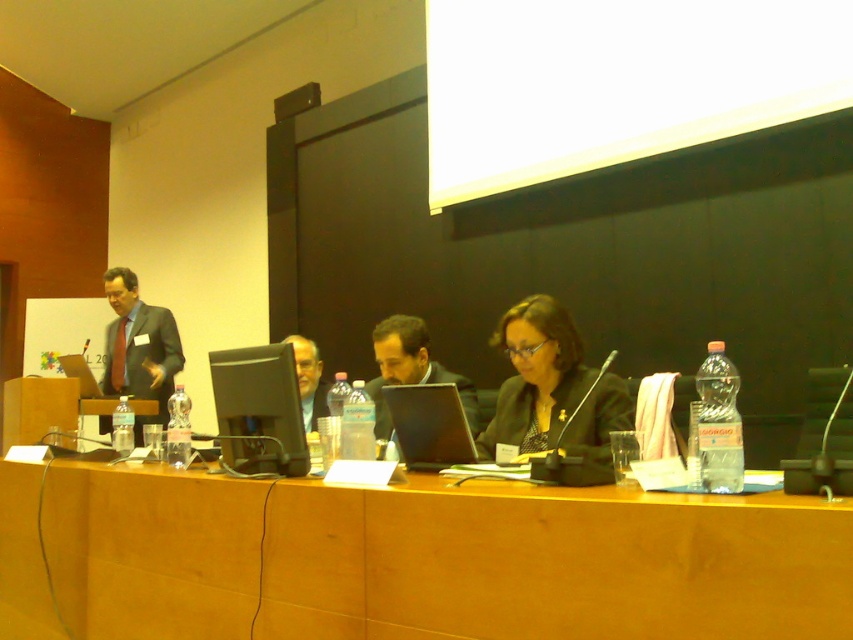
In the scene shown: You are organizing a conference and need to ensure there is enough space between the matte black suit at left and the matte black laptop at left for a presenter to move comfortably. Based on the image, can you determine if there is sufficient space?

The matte black suit at left might be wider than the matte black laptop at left, so there may not be enough space for the presenter to move comfortably between them.

You are sitting at the conference table and want to pass a document to the person at point (566, 381). Can you directly hand it to them without moving from your seat, or do you need to pass it through someone else at point (447, 422)?

Since point (566, 381) is behind point (447, 422), you would need to pass the document through the person at point (447, 422) to reach the person at point (566, 381).

You are standing at the back of the conference room and want to see both the point at position (164, 321) and the point at position (445, 433). Which point will appear closer to you?

The point at position (164, 321) will appear closer to you because it is further to the viewer than the point at position (445, 433).